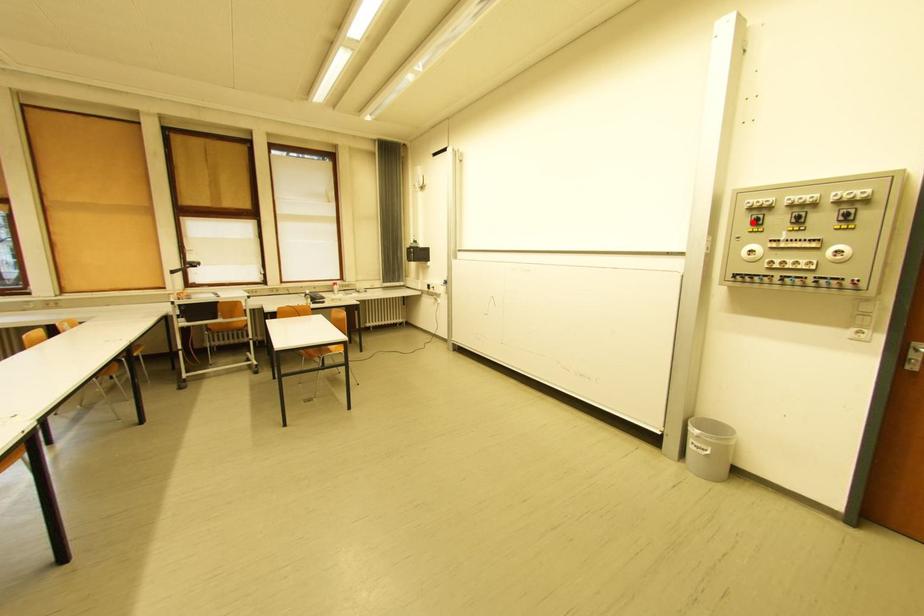
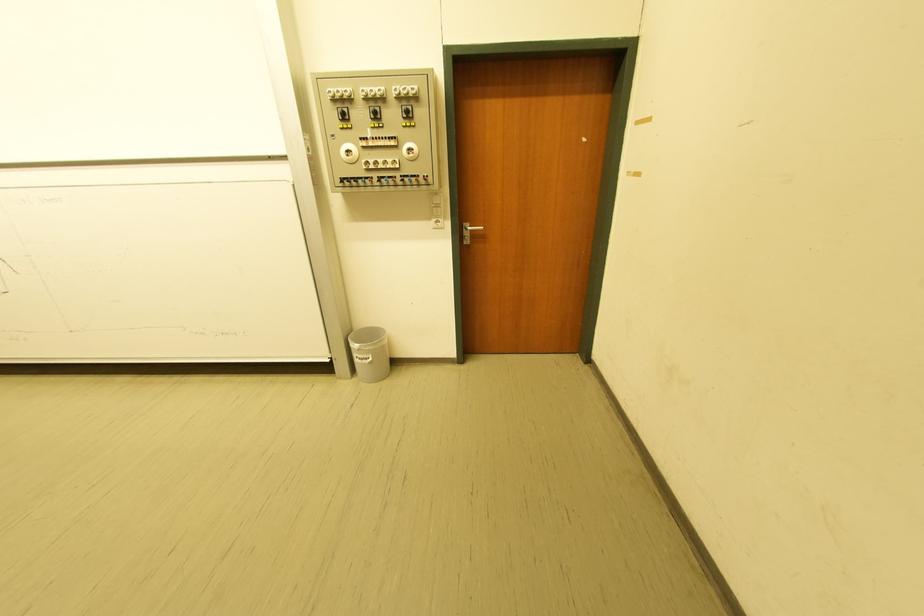
Where in the second image is the point corresponding to the highlighted location from the first image?

(342, 116)